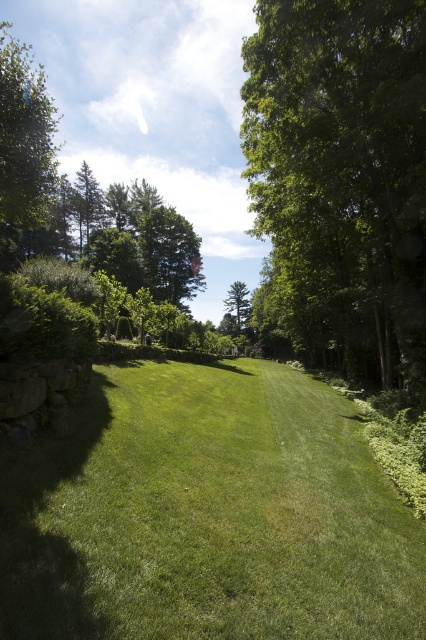
You are standing at the starting point of the garden pathway and want to reach a specific location. There are two points marked on your map as point 1 at coordinates point (377, 276) and point 2 at coordinates point (241, 330). According to the scene description, which point is closer to you as you begin your walk?

Point (377, 276) is in front of point (241, 330), so point (377, 276) is closer to you as you begin your walk.

In the scene shown: You are a gardener who wants to plant a new flower bed between the green grassy at lower left and the green matte tree at center. Based on their positions, which object should you start digging near to create the flower bed between them?

You should start digging near the green grassy at lower left because it is positioned on the left side of the green matte tree at center, so the space between them is to the right of the green grassy at lower left and to the left of the green matte tree at center.

You are a gardener planning to install a new bench in the garden. The bench is 2 meters long and needs to be placed between the green leafy tree at center and the green matte tree at center. Is there enough space between them to fit the bench?

The green leafy tree at center and green matte tree at center are 94.67 meters apart from each other. Since the bench is only 2 meters long, there is more than enough space between them to accommodate the bench comfortably.